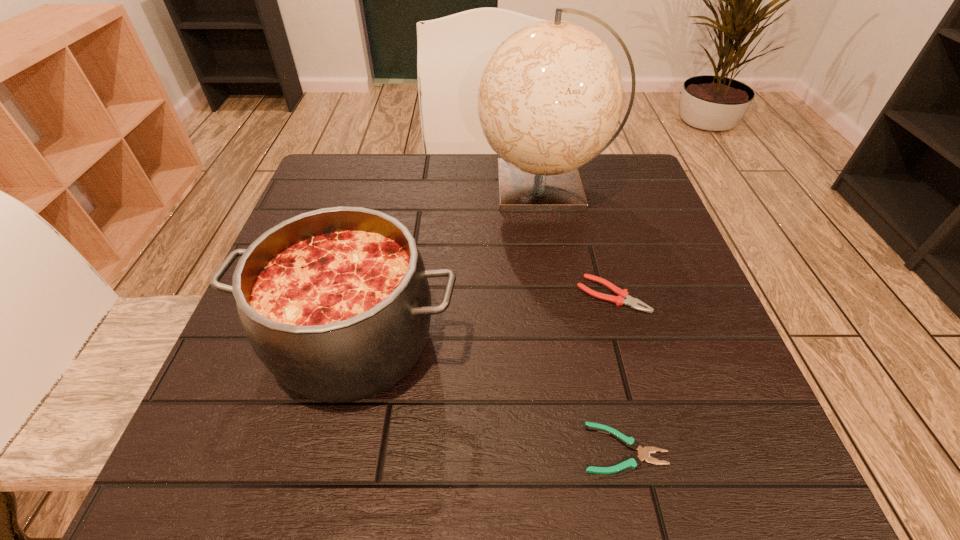
I want to click on free space at the far edge of the desktop, so click(489, 191).

Where is `free location at the near edge of the desktop`? The image size is (960, 540). free location at the near edge of the desktop is located at coordinates (511, 481).

The image size is (960, 540). Find the location of `free point at the left edge`. free point at the left edge is located at coordinates (244, 375).

The image size is (960, 540). In order to click on vacant space at the right edge in this screenshot , I will do `click(630, 214)`.

Image resolution: width=960 pixels, height=540 pixels. I want to click on vacant space at the far left corner, so click(344, 202).

Identify the location of vacant space at the near left corner of the desktop. The width and height of the screenshot is (960, 540). (284, 435).

Identify the location of vacant point at the far right corner. This screenshot has width=960, height=540. (618, 175).

This screenshot has width=960, height=540. I want to click on free region at the near right corner, so click(x=680, y=471).

Identify the location of free spot between the farthest object and the leftmost object. (449, 264).

Find the location of a particular element. blank region between the second tallest object and the nearest object is located at coordinates (489, 394).